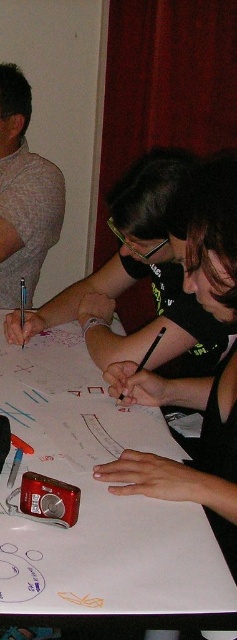
Question: Does white paper at center have a lesser width compared to gray matte shirt at left?

Choices:
 (A) no
 (B) yes

Answer: (A)

Question: Observing the image, what is the correct spatial positioning of white paper at center in reference to gray matte shirt at left?

Choices:
 (A) below
 (B) above

Answer: (A)

Question: Which of the following is the closest to the observer?

Choices:
 (A) (42, 428)
 (B) (0, 134)

Answer: (A)

Question: Which point appears closest to the camera in this image?

Choices:
 (A) (8, 156)
 (B) (169, 522)

Answer: (B)

Question: Can you confirm if white paper at center is smaller than gray matte shirt at left?

Choices:
 (A) no
 (B) yes

Answer: (A)